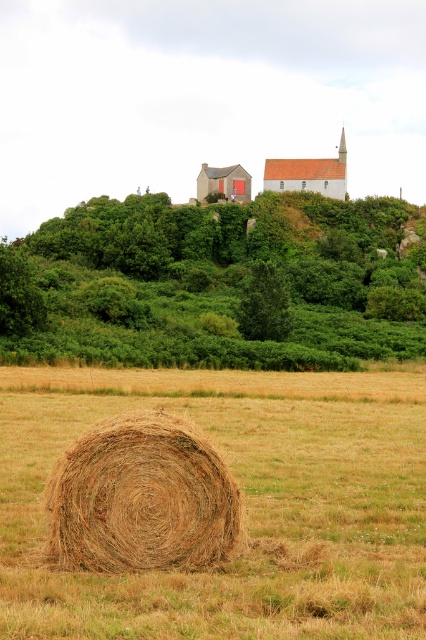
Looking at this image, is golden straw bale at center to the right of red brick church at upper center from the viewer's perspective?

In fact, golden straw bale at center is to the left of red brick church at upper center.

Is golden straw bale at center thinner than red brick church at upper center?

Yes, golden straw bale at center is thinner than red brick church at upper center.

Who is more forward, (120, 445) or (322, 186)?

Point (120, 445)

Where is `golden straw bale at center`? golden straw bale at center is located at coordinates (141, 499).

Does green leafy hillside at upper center appear on the left side of red brick church at upper center?

Correct, you'll find green leafy hillside at upper center to the left of red brick church at upper center.

Between point (187, 236) and point (340, 132), which one is positioned in front?

Point (187, 236) is in front.

This screenshot has height=640, width=426. I want to click on green leafy hillside at upper center, so click(224, 280).

Is brown straw bale at center bigger than red brick church at upper center?

No, brown straw bale at center is not bigger than red brick church at upper center.

Can you confirm if brown straw bale at center is thinner than red brick church at upper center?

No.

Describe the element at coordinates (244, 506) in the screenshot. I see `brown straw bale at center` at that location.

Find the location of `brown straw bale at center`. brown straw bale at center is located at coordinates (244, 506).